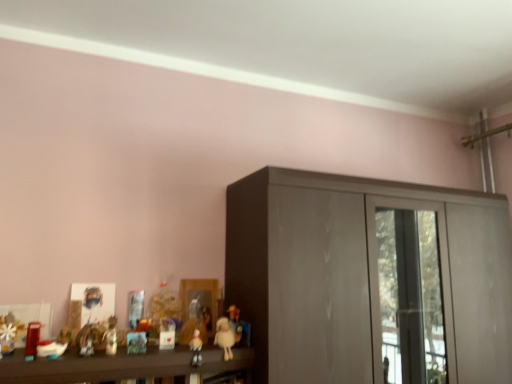
Question: Is fluffy white teddy bear at lower center, marked as the 2th toy in a right-to-left arrangement, bigger than matte yellow plush at center, marked as the first toy in a right-to-left arrangement?

Choices:
 (A) no
 (B) yes

Answer: (B)

Question: From the image's perspective, is fluffy white teddy bear at lower center, marked as the 2th toy in a right-to-left arrangement, below matte yellow plush at center, which appears as the 7th toy when viewed from the left?

Choices:
 (A) yes
 (B) no

Answer: (A)

Question: Could you tell me if fluffy white teddy bear at lower center, which is the 6th toy in left-to-right order, is turned towards matte yellow plush at center, which appears as the 7th toy when viewed from the left?

Choices:
 (A) yes
 (B) no

Answer: (B)

Question: Considering the relative sizes of fluffy white teddy bear at lower center, marked as the 2th toy in a right-to-left arrangement, and matte yellow plush at center, marked as the first toy in a right-to-left arrangement, in the image provided, is fluffy white teddy bear at lower center, marked as the 2th toy in a right-to-left arrangement, wider than matte yellow plush at center, marked as the first toy in a right-to-left arrangement,?

Choices:
 (A) no
 (B) yes

Answer: (B)

Question: From a real-world perspective, is fluffy white teddy bear at lower center, marked as the 2th toy in a right-to-left arrangement, over matte yellow plush at center, marked as the first toy in a right-to-left arrangement?

Choices:
 (A) yes
 (B) no

Answer: (B)

Question: From the image's perspective, is matte plastic toy at lower left, which is the fifth toy from right to left, positioned above or below fluffy white teddy bear at lower center, marked as the 2th toy in a right-to-left arrangement?

Choices:
 (A) above
 (B) below

Answer: (A)

Question: In terms of height, does matte plastic toy at lower left, which is the fifth toy from right to left, look taller or shorter compared to fluffy white teddy bear at lower center, which is the 6th toy in left-to-right order?

Choices:
 (A) short
 (B) tall

Answer: (A)

Question: Based on their positions, is matte plastic toy at lower left, which is the fifth toy from right to left, located to the left or right of fluffy white teddy bear at lower center, marked as the 2th toy in a right-to-left arrangement?

Choices:
 (A) left
 (B) right

Answer: (A)

Question: Is point (112, 347) positioned closer to the camera than point (232, 342)?

Choices:
 (A) closer
 (B) farther

Answer: (A)

Question: From their relative heights in the image, would you say fluffy white teddy bear at lower center, marked as the 2th toy in a right-to-left arrangement, is taller or shorter than matte plastic doll at center, which is the 3th toy from right to left?

Choices:
 (A) short
 (B) tall

Answer: (B)

Question: Is fluffy white teddy bear at lower center, marked as the 2th toy in a right-to-left arrangement, in front of or behind matte plastic doll at center, which is the 3th toy from right to left, in the image?

Choices:
 (A) behind
 (B) front

Answer: (A)

Question: Is point (218, 336) positioned closer to the camera than point (197, 365)?

Choices:
 (A) farther
 (B) closer

Answer: (A)

Question: From the image's perspective, is fluffy white teddy bear at lower center, marked as the 2th toy in a right-to-left arrangement, above or below matte plastic doll at center, which is the 3th toy from right to left?

Choices:
 (A) above
 (B) below

Answer: (A)

Question: From the image's perspective, is matte plastic toy at lower left, the sixth toy from the right, located above or below matte yellow plush at center, marked as the first toy in a right-to-left arrangement?

Choices:
 (A) below
 (B) above

Answer: (B)

Question: Looking at their shapes, would you say matte plastic toy at lower left, the second toy positioned from the left, is wider or thinner than matte yellow plush at center, which appears as the 7th toy when viewed from the left?

Choices:
 (A) wide
 (B) thin

Answer: (A)